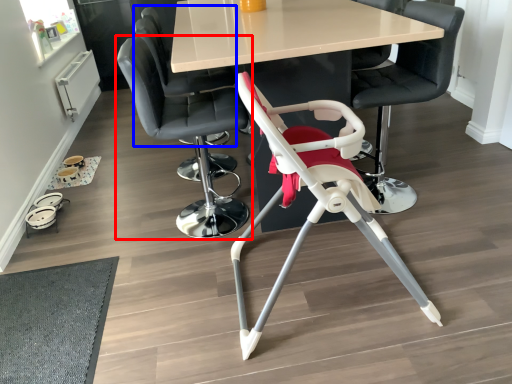
Question: Which object is further to the camera taking this photo, chair (highlighted by a red box) or chair (highlighted by a blue box)?

Choices:
 (A) chair
 (B) chair

Answer: (B)